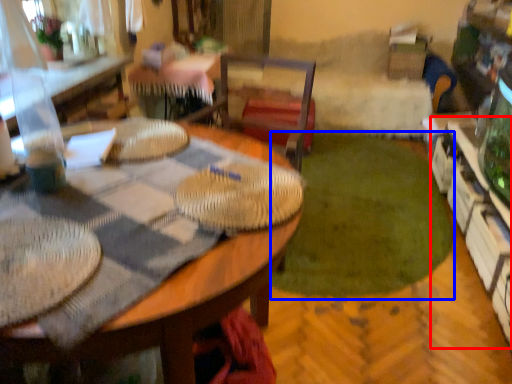
Question: Which object is closer to the camera taking this photo, shelf (highlighted by a red box) or grass (highlighted by a blue box)?

Choices:
 (A) shelf
 (B) grass

Answer: (A)